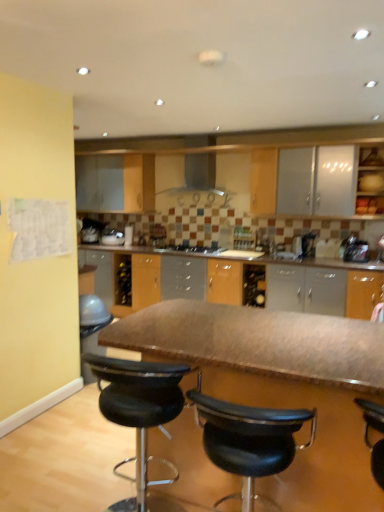
Question: From a real-world perspective, is black leather stool at center, positioned as the second chair in right-to-left order, physically located above or below satin black kettle at right, which is the second appliance from back to front?

Choices:
 (A) below
 (B) above

Answer: (A)

Question: Do you think black leather stool at center, positioned as the second chair in right-to-left order, is within satin black kettle at right, which is the second appliance from back to front, or outside of it?

Choices:
 (A) outside
 (B) inside

Answer: (A)

Question: Which is farther from the black leather stool at center, which is the first chair in left-to-right order?

Choices:
 (A) smooth brown table at center
 (B) satin black kettle at right, the second appliance in the left-to-right sequence
 (C) satin silver toaster at center, marked as the second appliance in a front-to-back arrangement
 (D) black leather stool at center, the 2th chair in the left-to-right sequence
 (E) matte wood cabinet at upper right

Answer: (C)

Question: Which of these objects is positioned farthest from the smooth brown table at center?

Choices:
 (A) satin silver toaster at center, marked as the second appliance in a front-to-back arrangement
 (B) black leather stool at center, the 2th chair in the left-to-right sequence
 (C) black leather stool at center, positioned as the second chair in right-to-left order
 (D) satin black kettle at right, the second appliance in the left-to-right sequence
 (E) matte wood cabinet at upper right

Answer: (A)